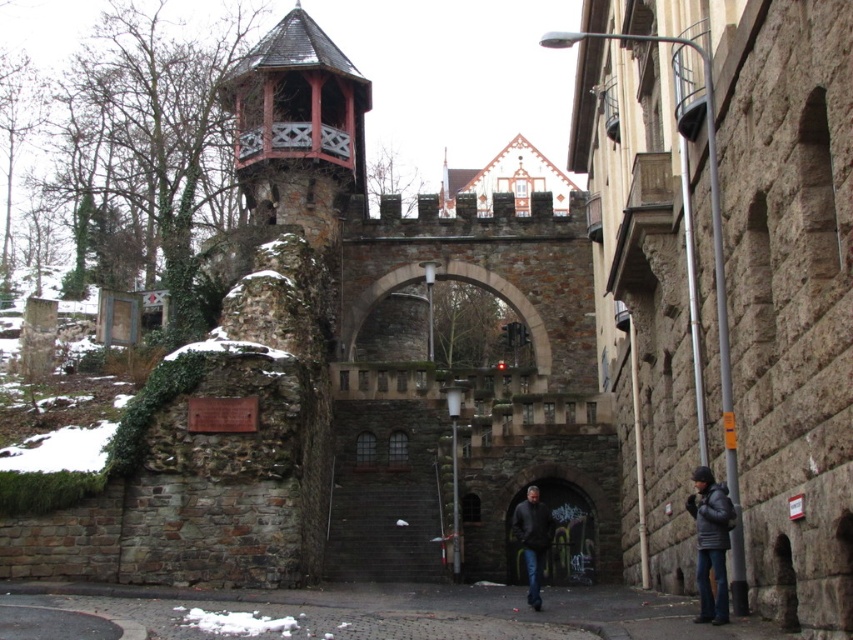
You are standing in front of the historic stone structure and want to take a photo. You notice two points marked in the scene. Which point, point (86, 592) or point (291, 113), is closer to your camera lens?

Point (86, 592) is closer to the camera lens than point (291, 113).

You are standing at the entrance of the historic stone structure and want to walk towards the dark gray cobblestone alley at lower center. What are the coordinates of the alley?

The dark gray cobblestone alley at lower center is located at coordinates point (415,609).

You are standing in front of the historic stone structure and want to determine the relative positions of two points marked on the image. Which point is closer to you, point (722, 593) or point (534, 488)?

Point (722, 593) is closer to the viewer than point (534, 488).